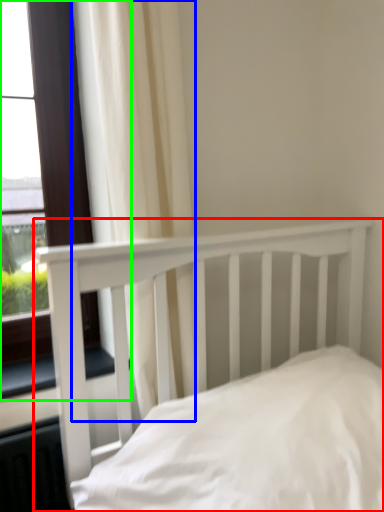
Question: Estimate the real-world distances between objects in this image. Which object is closer to bed (highlighted by a red box), curtain (highlighted by a blue box) or window (highlighted by a green box)?

Choices:
 (A) curtain
 (B) window

Answer: (A)